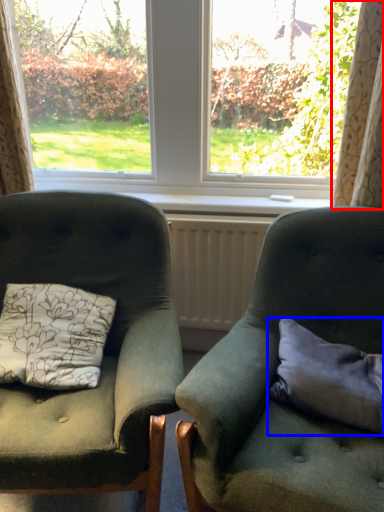
Question: Among these objects, which one is nearest to the camera, curtain (highlighted by a red box) or pillow (highlighted by a blue box)?

Choices:
 (A) curtain
 (B) pillow

Answer: (B)